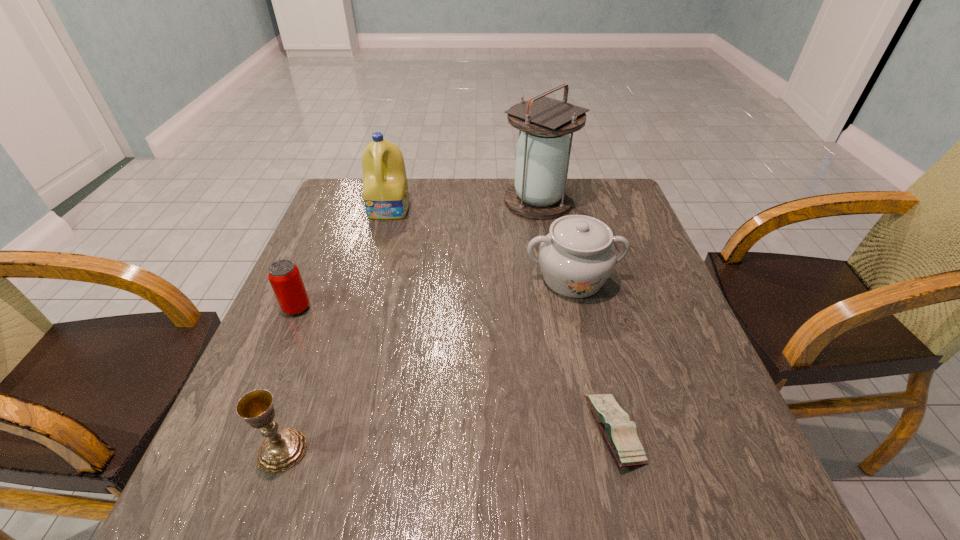
Identify the location of the fifth closest object relative to the lantern. (282, 449).

Identify the location of object identified as the fifth closest to the detergent. This screenshot has width=960, height=540. (620, 433).

Identify the location of free region that satisfies the following two spatial constraints: 1. on the label of the diary; 2. on the left side of the detergent. point(329,431).